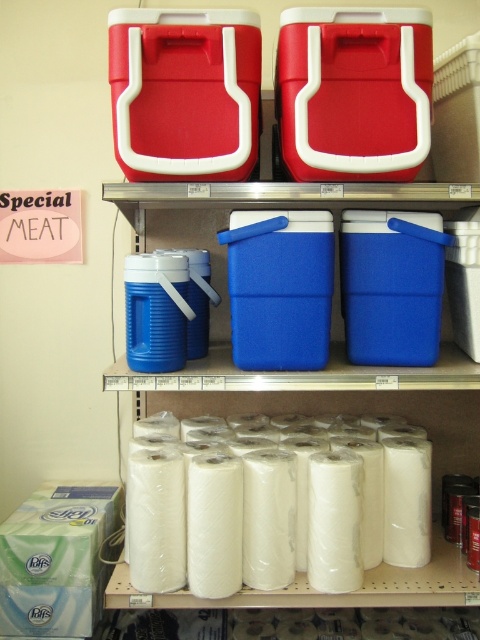
Question: Does white matte toilet paper at lower center have a greater width compared to blue plastic cooler at center?

Choices:
 (A) no
 (B) yes

Answer: (A)

Question: Does white matte toilet paper at lower center have a larger size compared to blue plastic cooler at center?

Choices:
 (A) yes
 (B) no

Answer: (B)

Question: Is white matte toilet paper at lower center in front of blue plastic cooler at center?

Choices:
 (A) no
 (B) yes

Answer: (A)

Question: Which point is closer to the camera taking this photo?

Choices:
 (A) (205, 234)
 (B) (361, 579)

Answer: (B)

Question: Which object is farther from the camera taking this photo?

Choices:
 (A) white matte toilet paper at lower center
 (B) blue plastic cooler at center

Answer: (A)